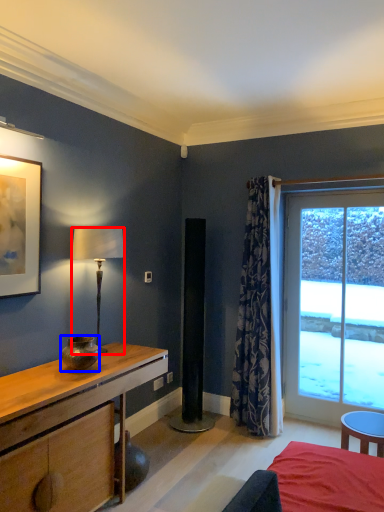
Question: Which point is further to the camera, lamp (highlighted by a red box) or vase (highlighted by a blue box)?

Choices:
 (A) lamp
 (B) vase

Answer: (A)